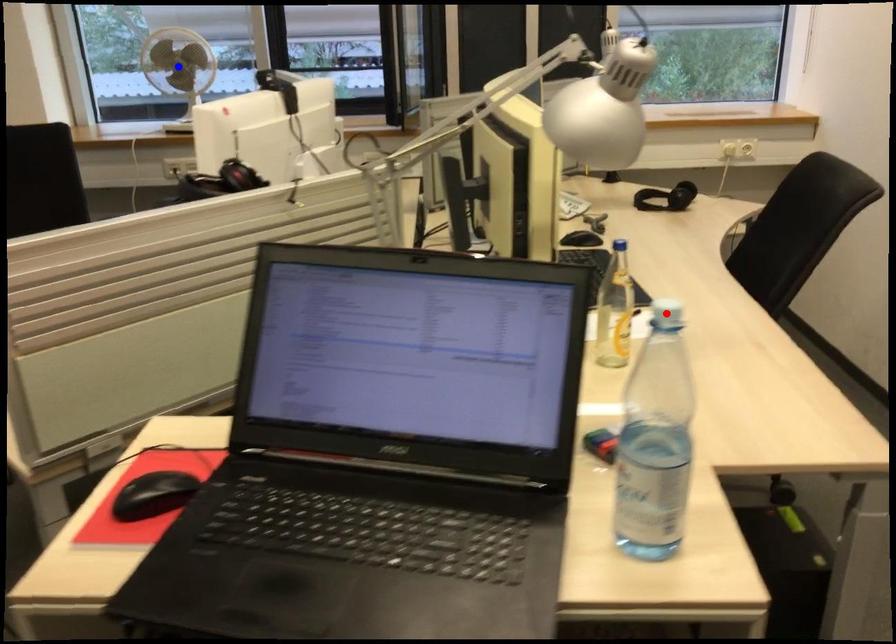
Question: In the image, two points are highlighted. Which point is nearer to the camera? Reply with the corresponding letter.

Choices:
 (A) blue point
 (B) red point

Answer: (B)